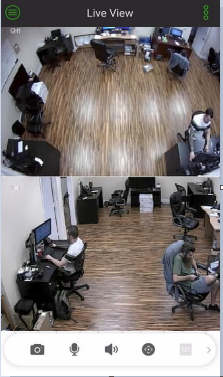
You are a GUI agent. You are given a task and a screenshot of the screen. Output one action in this format:
    pyautogui.click(x=<x>, y=<y>)
    Task: Click on the speaker
    The width and height of the screenshot is (223, 377).
    Given the screenshot: What is the action you would take?
    pyautogui.click(x=113, y=349)